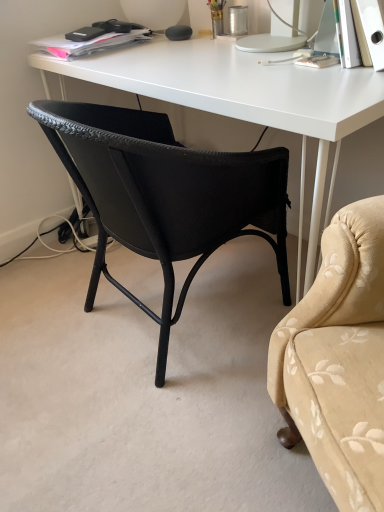
Where is `vacant area situated to the left side of black woven chair at center`? The height and width of the screenshot is (512, 384). vacant area situated to the left side of black woven chair at center is located at coordinates (41, 315).